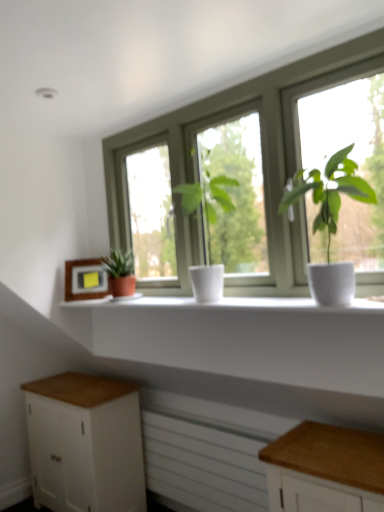
Question: Does wooden frame at left have a greater width compared to white matte window sill at center?

Choices:
 (A) yes
 (B) no

Answer: (B)

Question: Is wooden frame at left at the left side of white matte window sill at center?

Choices:
 (A) yes
 (B) no

Answer: (A)

Question: Does wooden frame at left have a lesser width compared to white matte window sill at center?

Choices:
 (A) no
 (B) yes

Answer: (B)

Question: Is wooden frame at left positioned before white matte window sill at center?

Choices:
 (A) no
 (B) yes

Answer: (A)

Question: From the image's perspective, is wooden frame at left beneath white matte window sill at center?

Choices:
 (A) no
 (B) yes

Answer: (A)

Question: In terms of height, does white matte window at center look taller or shorter compared to wooden frame at left?

Choices:
 (A) tall
 (B) short

Answer: (A)

Question: Which is correct: white matte window at center is inside wooden frame at left, or outside of it?

Choices:
 (A) outside
 (B) inside

Answer: (A)

Question: Considering the relative positions of white matte window at center and wooden frame at left in the image provided, is white matte window at center to the left or to the right of wooden frame at left?

Choices:
 (A) right
 (B) left

Answer: (A)

Question: From a real-world perspective, is white matte window at center physically located above or below wooden frame at left?

Choices:
 (A) above
 (B) below

Answer: (A)

Question: Based on their sizes in the image, would you say white matte window sill at center is bigger or smaller than white matte plant pot at center, the 3th houseplant from the left?

Choices:
 (A) big
 (B) small

Answer: (B)

Question: Considering the relative positions of white matte window sill at center and white matte plant pot at center, the 3th houseplant from the left, in the image provided, is white matte window sill at center to the left or to the right of white matte plant pot at center, the 3th houseplant from the left,?

Choices:
 (A) right
 (B) left

Answer: (B)

Question: Is white matte window sill at center in front of or behind white matte plant pot at center, the 1th houseplant positioned from the right, in the image?

Choices:
 (A) behind
 (B) front

Answer: (A)

Question: Considering the positions of white matte window sill at center and white matte plant pot at center, which appears as the 1th houseplant when viewed from the front, in the image, is white matte window sill at center wider or thinner than white matte plant pot at center, which appears as the 1th houseplant when viewed from the front,?

Choices:
 (A) wide
 (B) thin

Answer: (B)

Question: Based on their positions, is white matte plant pot at center, which appears as the 1th houseplant when viewed from the front, located to the left or right of green matte plant at left, arranged as the first houseplant when viewed from the back?

Choices:
 (A) right
 (B) left

Answer: (A)

Question: Is point (332, 272) closer or farther from the camera than point (110, 266)?

Choices:
 (A) farther
 (B) closer

Answer: (B)